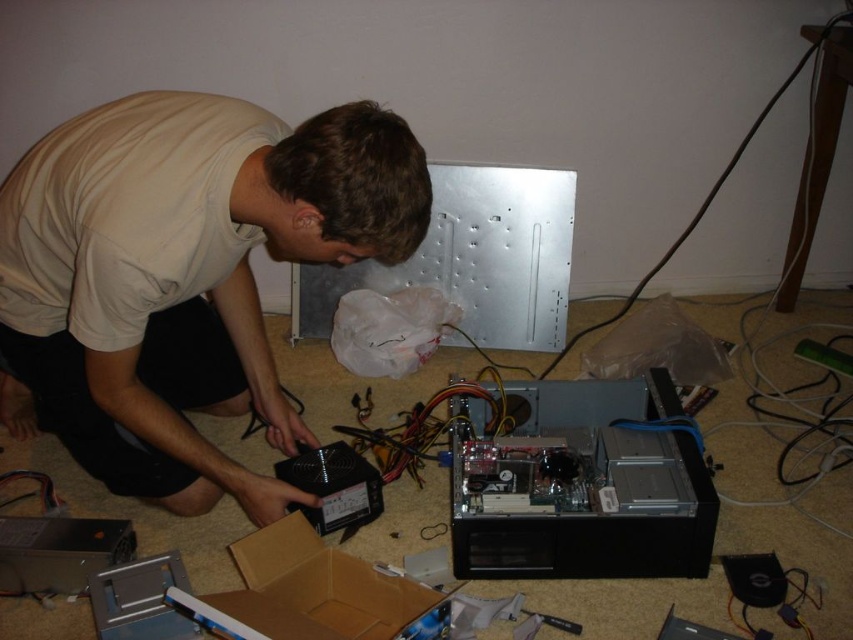
Can you confirm if black plastic power supply at center is taller than brown cardboard box at lower center?

Indeed, black plastic power supply at center has a greater height compared to brown cardboard box at lower center.

Does black plastic power supply at center have a greater width compared to brown cardboard box at lower center?

Yes.

Is point (62, 296) farther from camera compared to point (279, 547)?

That is False.

Where is `black plastic power supply at center`? black plastic power supply at center is located at coordinates (184, 275).